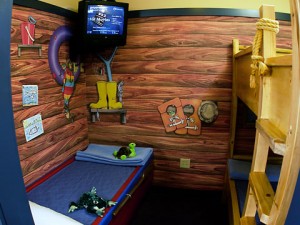
In order to click on 1 tv in this screenshot , I will do `click(101, 20)`.